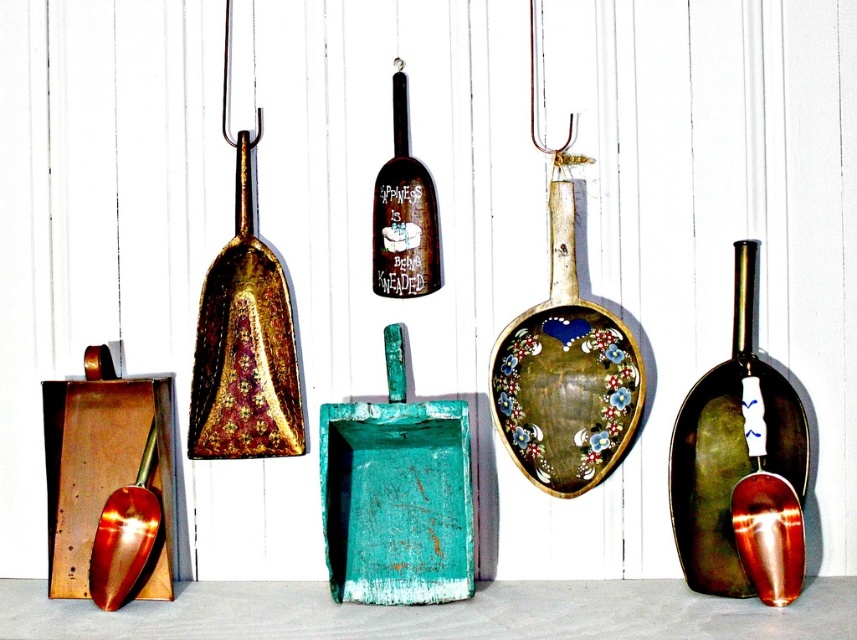
Can you confirm if shiny metallic shovel at right is smaller than brushed gold shovel at lower left?

No.

Does shiny metallic shovel at right lie behind brushed gold shovel at lower left?

No, it is not.

Who is more forward, (774, 371) or (130, 582)?

Point (130, 582)

Find the location of a particular element. This screenshot has width=857, height=640. shiny metallic shovel at right is located at coordinates (740, 468).